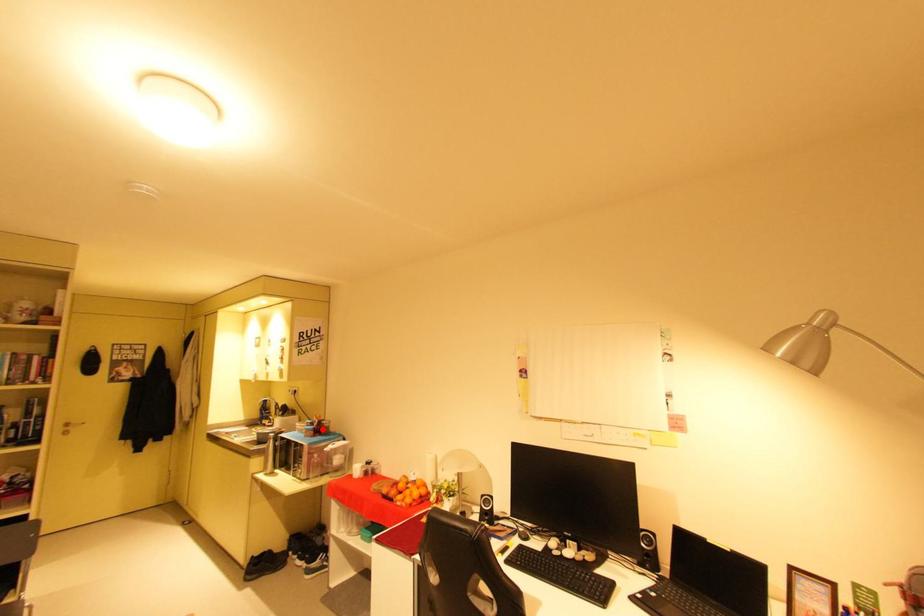
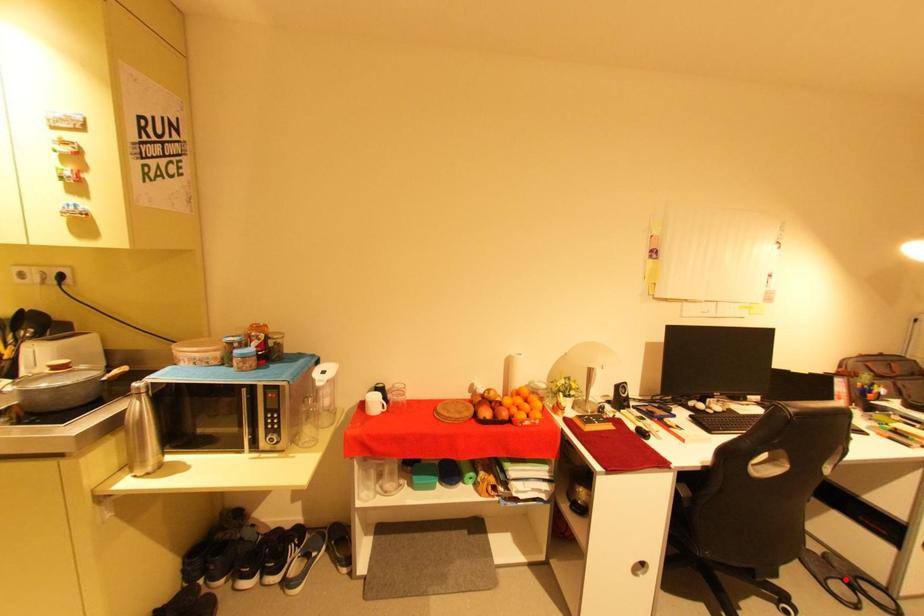
From the picture: I am providing you with two images of the same scene from different viewpoints. A red point is marked on the first image and another point is marked on the second image. Is the red point in image1 aligned with the point shown in image2?

No